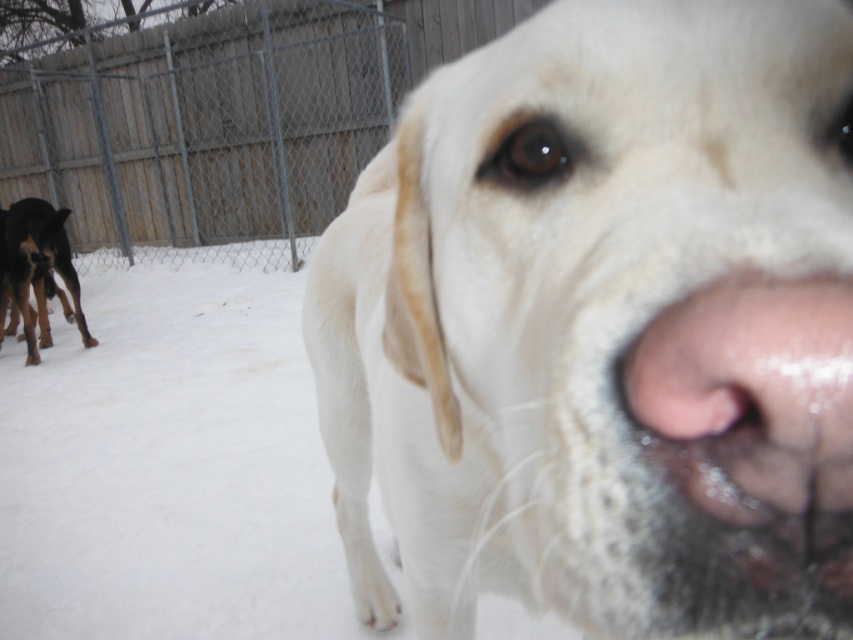
Question: Which point appears farthest from the camera in this image?

Choices:
 (A) (335, 152)
 (B) (24, 326)

Answer: (A)

Question: Does white fur dog at center appear under black fur dog at left?

Choices:
 (A) yes
 (B) no

Answer: (A)

Question: Does white fur dog at center have a smaller size compared to metal chain-link fence at upper left?

Choices:
 (A) no
 (B) yes

Answer: (B)

Question: Which point is farther to the camera?

Choices:
 (A) black fur dog at left
 (B) metal chain-link fence at upper left

Answer: (B)

Question: Which of the following is the farthest from the observer?

Choices:
 (A) black fur dog at left
 (B) white fur dog at center

Answer: (A)

Question: Is white fur dog at center wider than black fur dog at left?

Choices:
 (A) yes
 (B) no

Answer: (B)